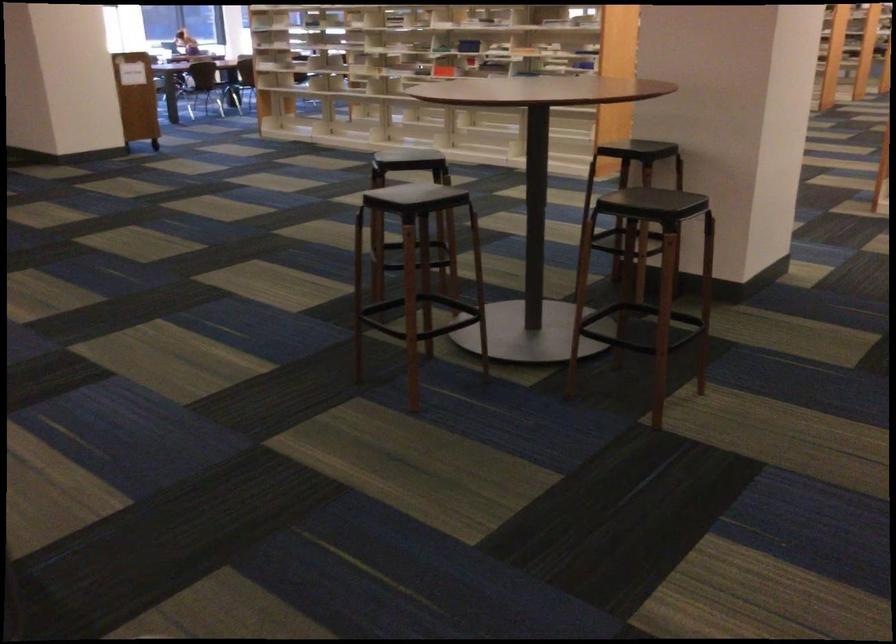
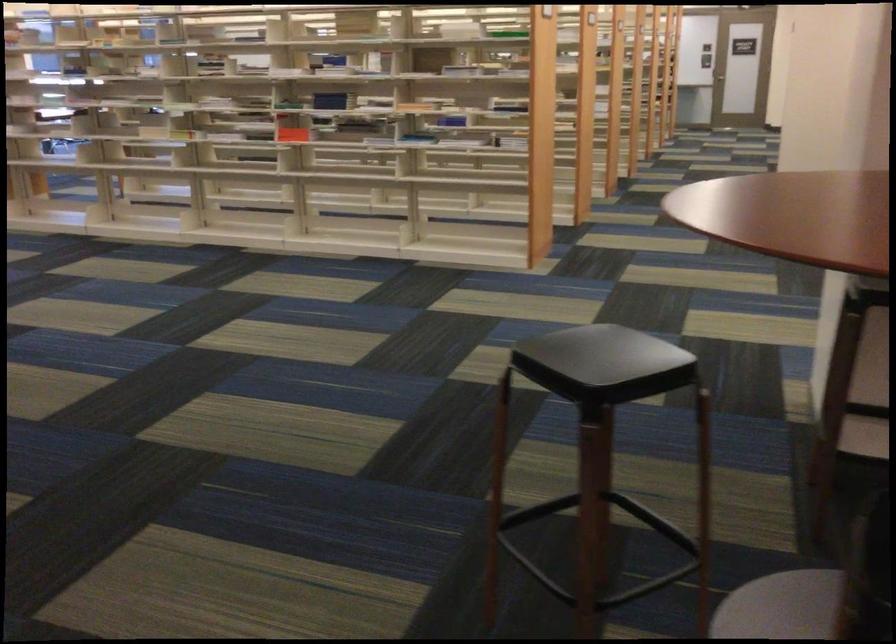
The images are taken continuously from a first-person perspective. In which direction are you moving?

The cameraman walked toward left, forward.